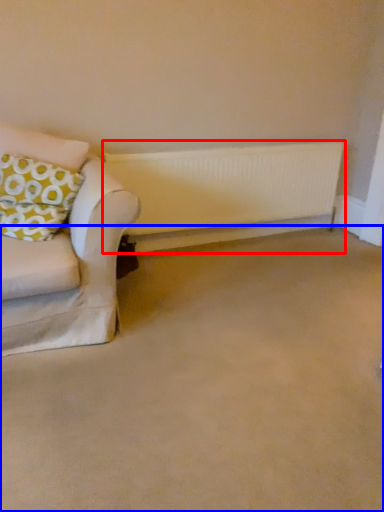
Question: Which of the following is the farthest to the observer, radiator (highlighted by a red box) or plain (highlighted by a blue box)?

Choices:
 (A) radiator
 (B) plain

Answer: (A)